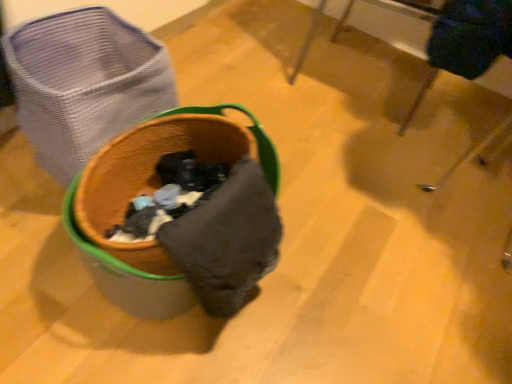
Question: Is point (473, 77) closer or farther from the camera than point (79, 132)?

Choices:
 (A) closer
 (B) farther

Answer: (B)

Question: In terms of width, does wooden table at upper center look wider or thinner when compared to rattan laundry basket at left?

Choices:
 (A) thin
 (B) wide

Answer: (B)

Question: Considering the positions of wooden table at upper center and rattan laundry basket at left in the image, is wooden table at upper center bigger or smaller than rattan laundry basket at left?

Choices:
 (A) small
 (B) big

Answer: (B)

Question: Is point (90, 41) positioned closer to the camera than point (473, 59)?

Choices:
 (A) closer
 (B) farther

Answer: (B)

Question: In terms of height, does rattan laundry basket at left look taller or shorter compared to wooden table at upper center?

Choices:
 (A) short
 (B) tall

Answer: (A)

Question: In the image, is rattan laundry basket at left positioned in front of or behind wooden table at upper center?

Choices:
 (A) front
 (B) behind

Answer: (A)

Question: From a real-world perspective, relative to wooden table at upper center, is rattan laundry basket at left vertically above or below?

Choices:
 (A) above
 (B) below

Answer: (B)